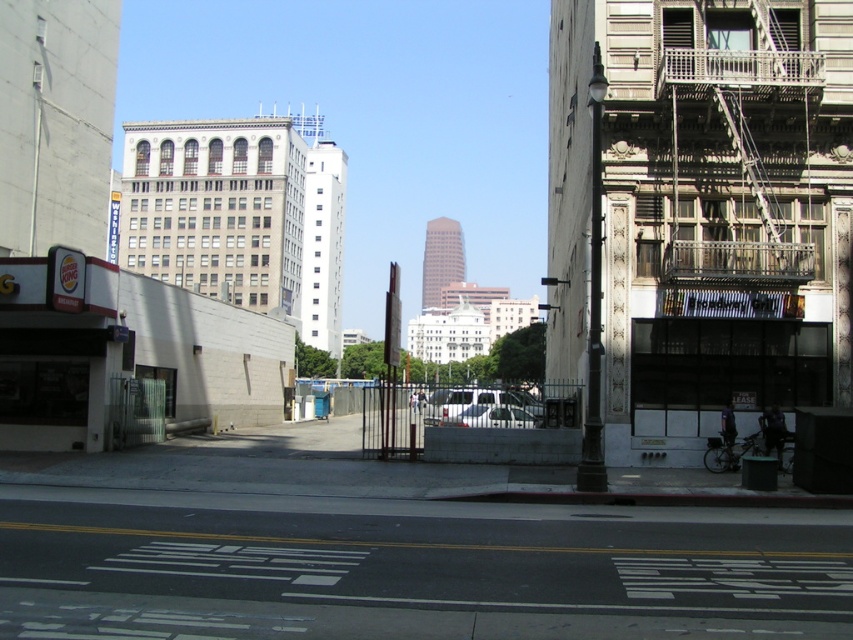
You are a delivery driver who needs to park your 2.5 meter wide truck in this urban scene. You see the metallic silver fire escape at right and the silver metallic van at center. Which parking spot near these objects can accommodate your truck based on their widths?

The metallic silver fire escape at right is wider than the silver metallic van at center, so the parking spot near the metallic silver fire escape at right can accommodate your truck since it has enough width.

You are a delivery person needing to park your car near the Burger King restaurant. You see the metallic silver fire escape at right and the silver metallic car at center. Which object is closer to the Burger King restaurant?

The silver metallic car at center is closer to the Burger King restaurant because the metallic silver fire escape at right is to the right of the silver metallic car at center, meaning it is farther away from the restaurant located on the left side of the image.

You are a pedestrian standing at the crosswalk on the left side of the image. You want to cross the road to the Burger King restaurant. However, there are two vehicles in the middle ground that might block your path. Can you safely cross between the silver metallic van at center and the silver metallic car at center?

The silver metallic car at center is behind the silver metallic van at center, so there is space between them for you to cross safely.